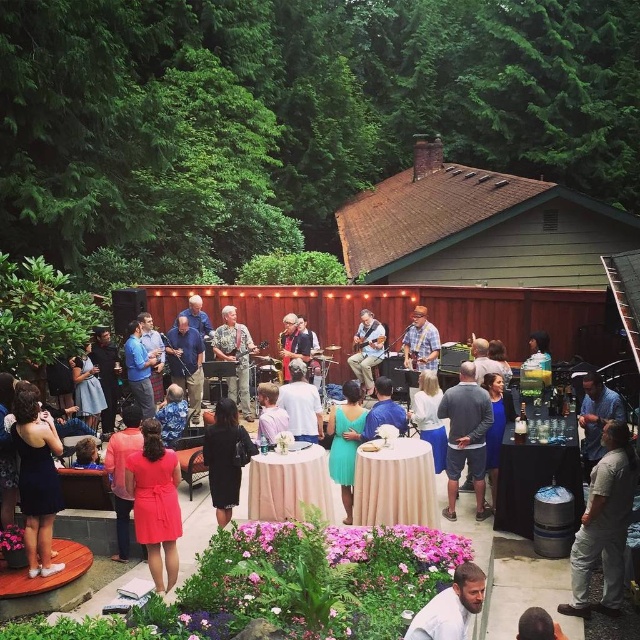
You are standing at the origin point of the coordinate system in the image. Where is the matte black dress at center located in terms of its 2D coordinates?

The matte black dress at center is located at the 2D coordinates of point [541,461].

You are standing in the backyard and want to take a photo. There are two points of interest marked as point 1 and point 2. Point 1 is located at coordinates (518, 449) and point 2 at (147, 412). If you want to capture both points in a single frame, which point should you focus on first to ensure both are in focus?

You should focus on point 1 first because it is closer to the camera than point 2, ensuring both points will be in focus when using a proper depth of field.